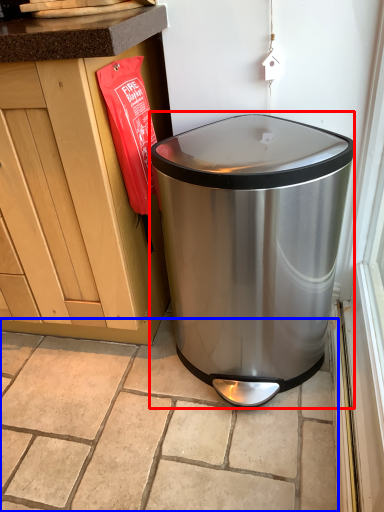
Question: Which object appears farthest to the camera in this image, waste container (highlighted by a red box) or tile (highlighted by a blue box)?

Choices:
 (A) waste container
 (B) tile

Answer: (B)